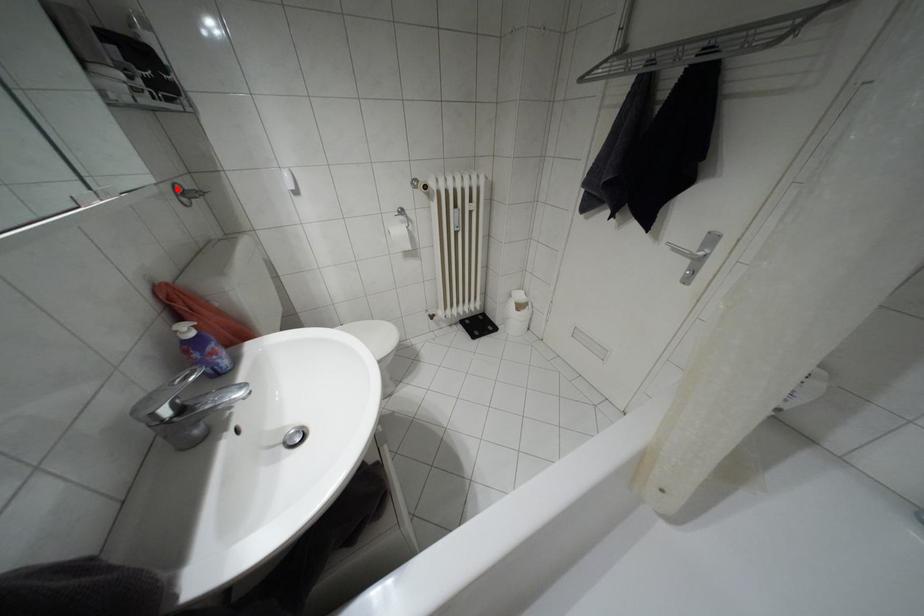
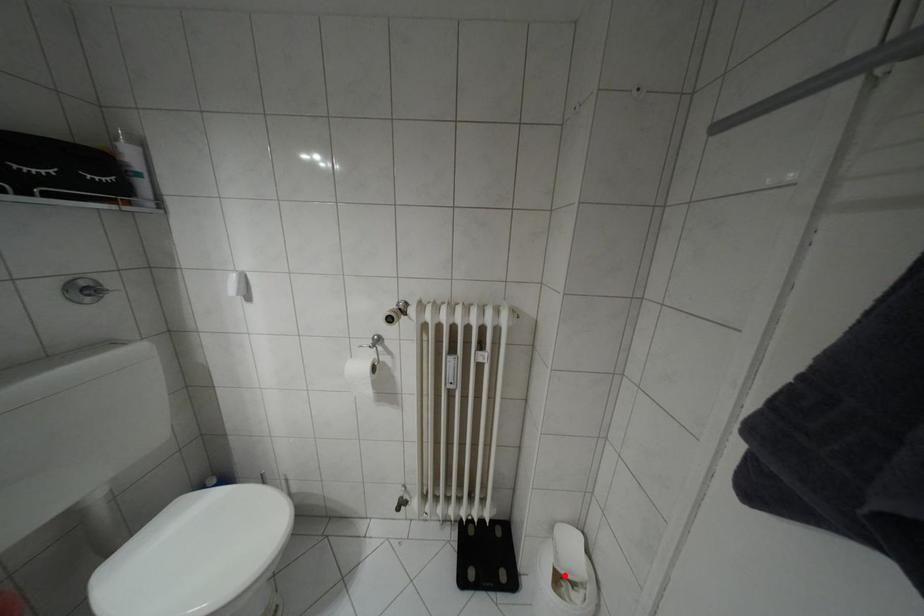
I am providing you with two images of the same scene from different viewpoints. A red point is marked on the first image and another point is marked on the second image. Are the points marked in image1 and image2 representing the same 3D position?

No